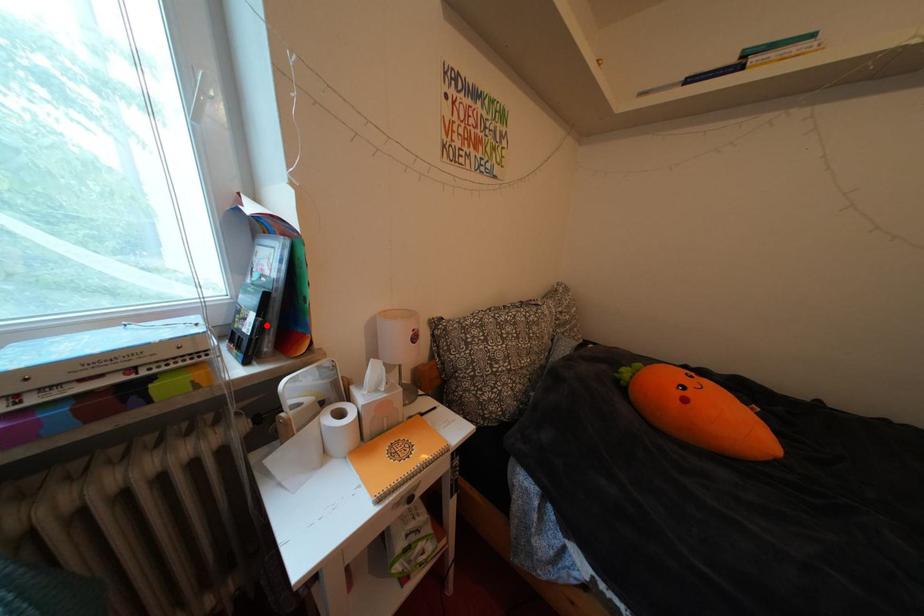
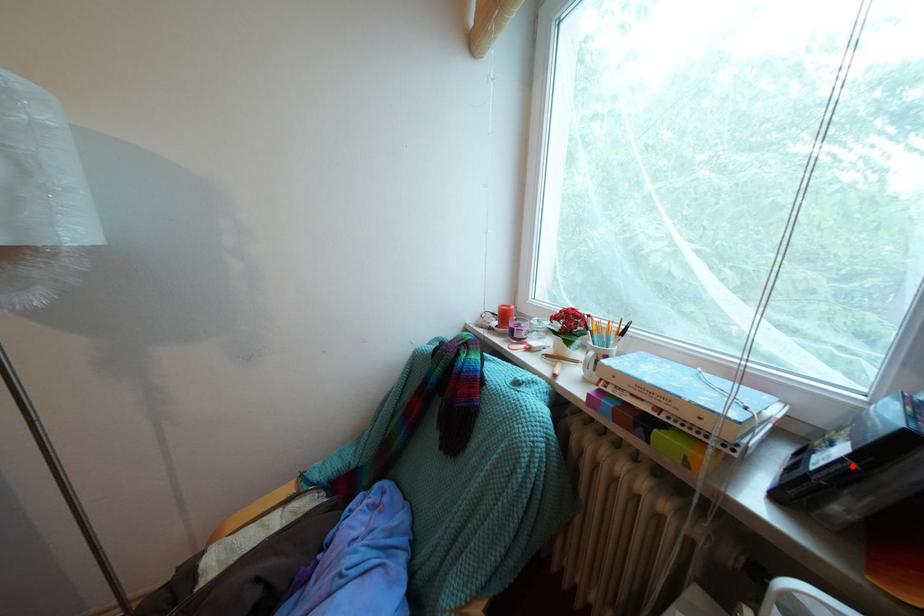
I am providing you with two images of the same scene from different viewpoints. A red point is marked on the first image and another point is marked on the second image. Is the marked point in image1 the same physical position as the marked point in image2?

Yes